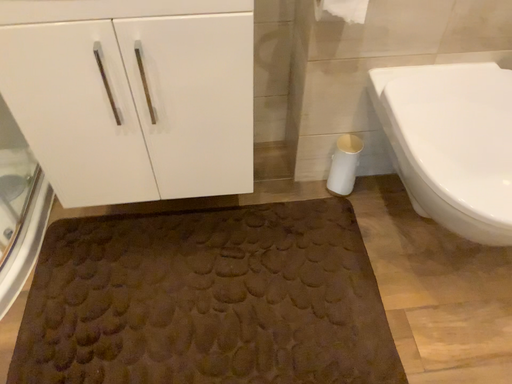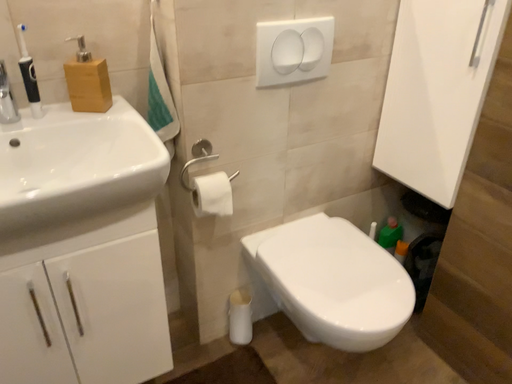
Question: How did the camera likely rotate when shooting the video?

Choices:
 (A) rotated left
 (B) rotated right

Answer: (B)